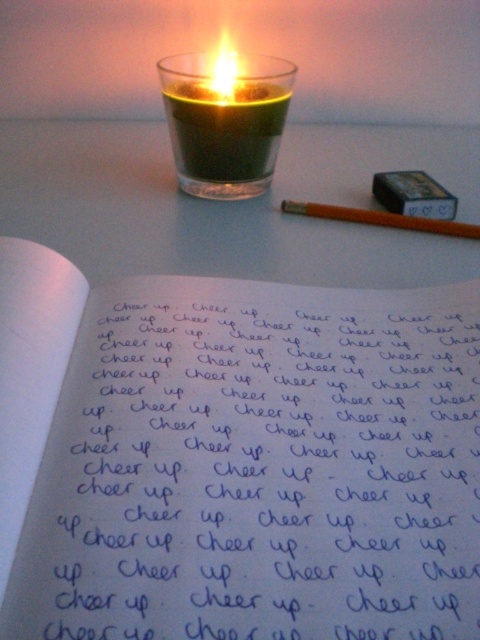
Question: Can you confirm if green glass at center is positioned to the left of translucent glass candle at upper center?

Choices:
 (A) no
 (B) yes

Answer: (A)

Question: Can you confirm if blue ink notebook at center is smaller than orange wood pencil at upper right?

Choices:
 (A) yes
 (B) no

Answer: (B)

Question: Which point appears farthest from the camera in this image?

Choices:
 (A) (228, 93)
 (B) (416, 221)
 (C) (237, 323)
 (D) (226, 83)

Answer: (A)

Question: Which of the following is the farthest from the observer?

Choices:
 (A) (296, 209)
 (B) (233, 96)
 (C) (217, 182)

Answer: (C)

Question: Which point appears farthest from the camera in this image?

Choices:
 (A) (355, 417)
 (B) (340, 211)

Answer: (B)

Question: Is green glass at center further to the viewer compared to orange wood pencil at upper right?

Choices:
 (A) yes
 (B) no

Answer: (A)